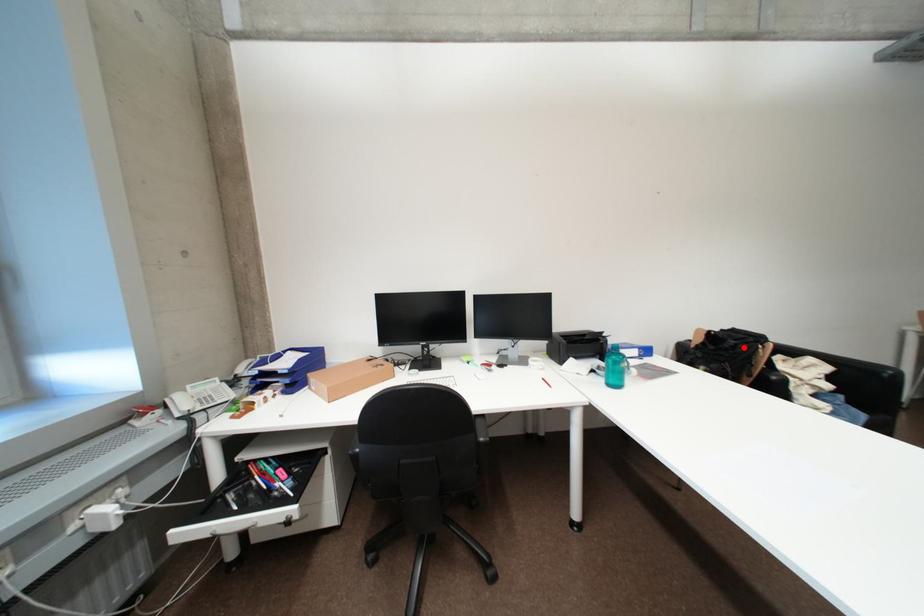
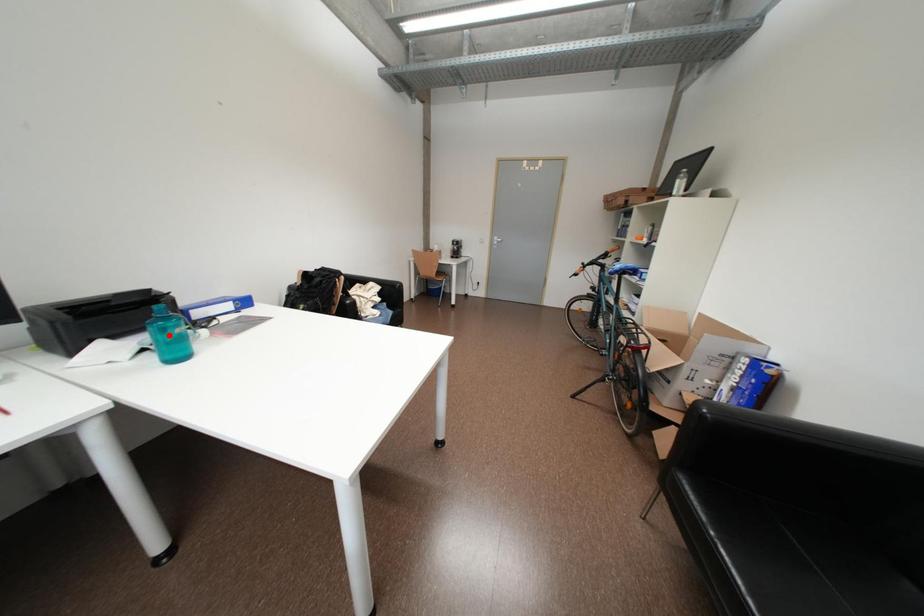
I am providing you with two images of the same scene from different viewpoints. A red point is marked on the first image and another point is marked on the second image. Is the red point in image1 aligned with the point shown in image2?

No